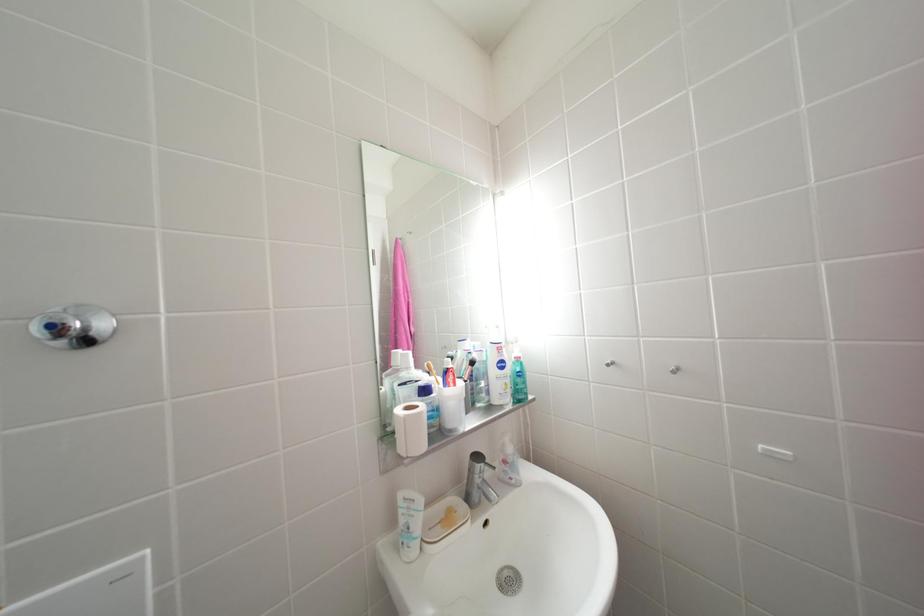
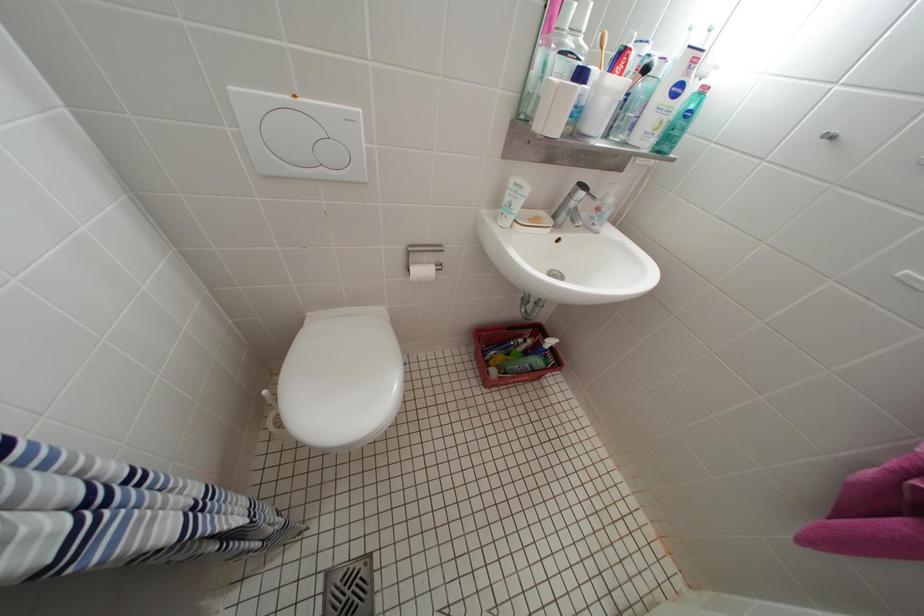
Question: The images are taken continuously from a first-person perspective. In which direction is your viewpoint rotating?

Choices:
 (A) Left
 (B) Right
 (C) Up
 (D) Down

Answer: (D)